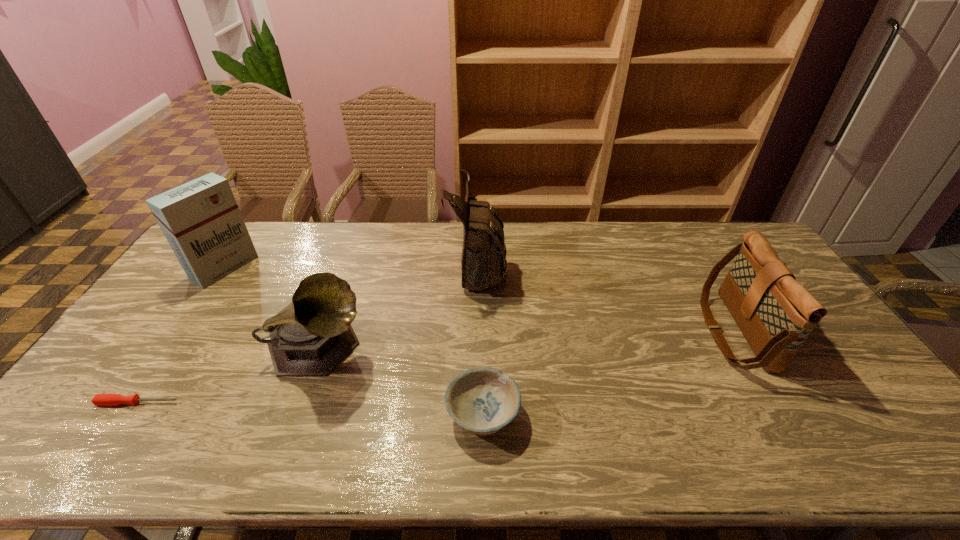
Where is `the taller shoulder bag`? The image size is (960, 540). the taller shoulder bag is located at coordinates (483, 261).

Locate an element on the screen. This screenshot has height=540, width=960. the left shoulder bag is located at coordinates (483, 261).

At what (x,y) coordinates should I click in order to perform the action: click on cigarette case. Please return your answer as a coordinate pair (x, y). The height and width of the screenshot is (540, 960). Looking at the image, I should click on (200, 219).

Locate an element on the screen. The height and width of the screenshot is (540, 960). the third object from left to right is located at coordinates (313, 334).

Find the location of a particular element. the rightmost object is located at coordinates (775, 313).

This screenshot has height=540, width=960. I want to click on the shorter shoulder bag, so click(775, 313).

At what (x,y) coordinates should I click in order to perform the action: click on the fifth tallest object. Please return your answer as a coordinate pair (x, y). Image resolution: width=960 pixels, height=540 pixels. Looking at the image, I should click on (482, 400).

Find the location of `screwdriver`. screwdriver is located at coordinates (99, 399).

You are a GUI agent. You are given a task and a screenshot of the screen. Output one action in this format:
    pyautogui.click(x=<x>, y=<y>)
    Task: Click on the vacant space located 0.220m on the front-facing side of the taller shoulder bag
    The image size is (960, 540).
    Given the screenshot: What is the action you would take?
    pyautogui.click(x=570, y=266)

The image size is (960, 540). What are the coordinates of `free space located 0.150m on the front of the cigarette case` in the screenshot? It's located at (187, 324).